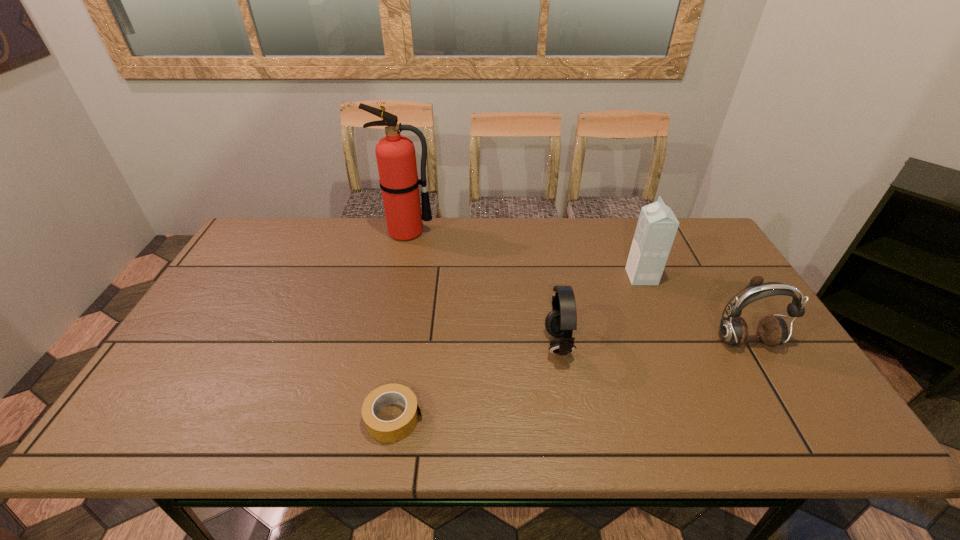
You are a GUI agent. You are given a task and a screenshot of the screen. Output one action in this format:
    pyautogui.click(x=<x>, y=<y>)
    Task: Click on the farthest object
    
    Given the screenshot: What is the action you would take?
    pyautogui.click(x=395, y=154)

In order to click on fire extinguisher in this screenshot , I will do `click(395, 154)`.

Identify the location of the second object from right to left. (657, 226).

The image size is (960, 540). Find the location of `the fourth nearest object`. the fourth nearest object is located at coordinates (657, 226).

The height and width of the screenshot is (540, 960). In order to click on the third shortest object in this screenshot , I will do `click(772, 330)`.

The width and height of the screenshot is (960, 540). In order to click on the rightmost object in this screenshot , I will do `click(772, 330)`.

In order to click on the left earphone in this screenshot , I will do coord(562,320).

Image resolution: width=960 pixels, height=540 pixels. In order to click on the fourth tallest object in this screenshot , I will do `click(562, 320)`.

Where is `the nearest object`? This screenshot has width=960, height=540. the nearest object is located at coordinates (384, 431).

Locate an element on the screen. The height and width of the screenshot is (540, 960). the shortest object is located at coordinates (384, 431).